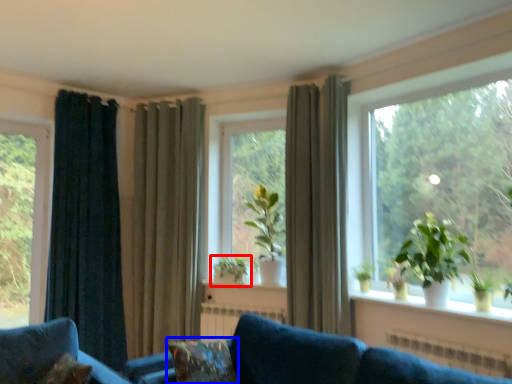
Question: Which object is further to the camera taking this photo, houseplant (highlighted by a red box) or pillow (highlighted by a blue box)?

Choices:
 (A) houseplant
 (B) pillow

Answer: (A)